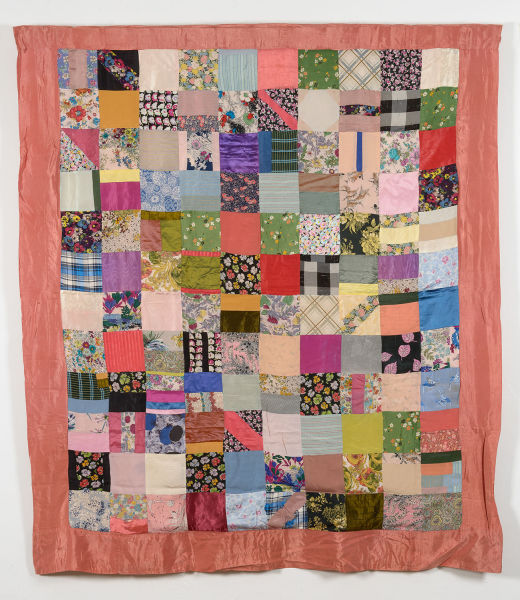
Identify the location of patchwork quilt. This screenshot has width=520, height=600. (488, 283).